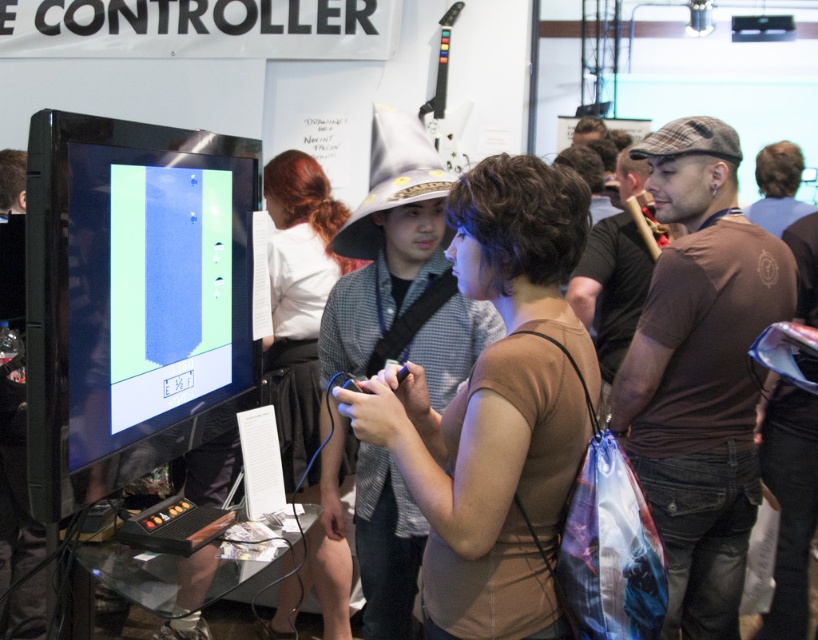
Does brown matte shirt at center appear under brown cotton shirt at right?

Yes, brown matte shirt at center is below brown cotton shirt at right.

Based on the photo, does brown matte shirt at center lie behind brown cotton shirt at right?

That is False.

Which is behind, point (583, 234) or point (622, 244)?

The point (622, 244) is more distant.

The width and height of the screenshot is (818, 640). I want to click on brown matte shirt at center, so tap(497, 408).

Does point (232, 426) lie behind point (682, 564)?

No, it is not.

Is shiny black monitor at left shorter than brown cotton t-shirt at center-right?

Yes, shiny black monitor at left is shorter than brown cotton t-shirt at center-right.

Between point (45, 168) and point (704, 145), which one is positioned behind?

The point (704, 145) is behind.

This screenshot has height=640, width=818. In order to click on shiny black monitor at left in this screenshot , I will do `click(131, 298)`.

Image resolution: width=818 pixels, height=640 pixels. I want to click on shiny black monitor at left, so click(x=131, y=298).

Can you confirm if shiny black monitor at left is taller than brown cotton shirt at right?

No, shiny black monitor at left is not taller than brown cotton shirt at right.

Is point (154, 371) closer to camera compared to point (600, 314)?

Yes, it is in front of point (600, 314).

The image size is (818, 640). Identify the location of shiny black monitor at left. (131, 298).